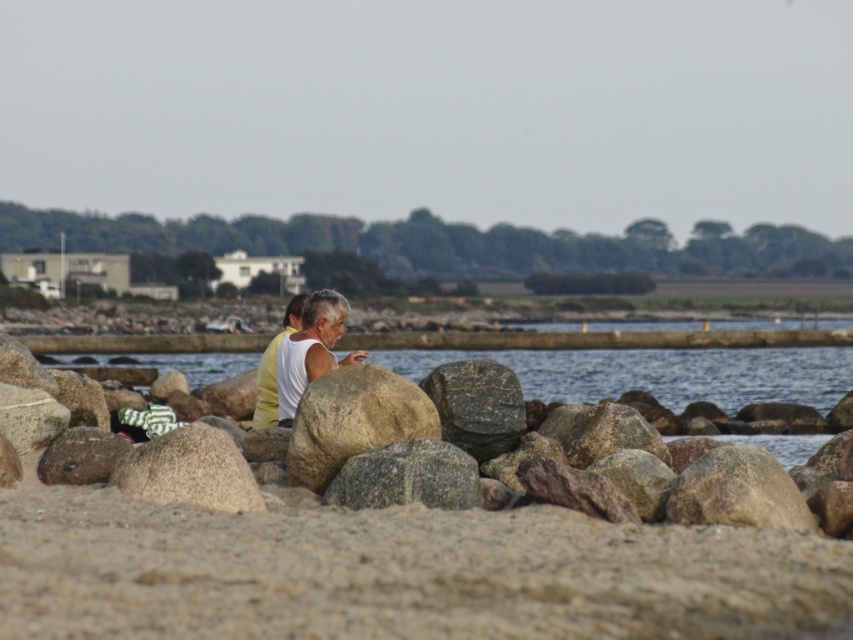
Question: Does smooth beige sand at lower center have a smaller size compared to granite boulder at center?

Choices:
 (A) no
 (B) yes

Answer: (B)

Question: Can you confirm if smooth beige sand at lower center is bigger than yellow fabric shirt at center?

Choices:
 (A) yes
 (B) no

Answer: (B)

Question: Which point is closer to the camera?

Choices:
 (A) (206, 381)
 (B) (154, 611)
 (C) (279, 401)

Answer: (B)

Question: Among these objects, which one is nearest to the camera?

Choices:
 (A) yellow fabric shirt at center
 (B) clear water at center
 (C) granite boulder at center

Answer: (C)

Question: Which of the following is the closest to the observer?

Choices:
 (A) click(x=291, y=436)
 (B) click(x=300, y=365)
 (C) click(x=646, y=378)

Answer: (A)

Question: Where is clear water at center located in relation to granite boulder at center in the image?

Choices:
 (A) right
 (B) left

Answer: (A)